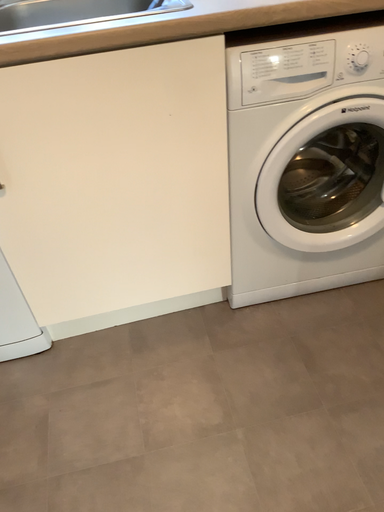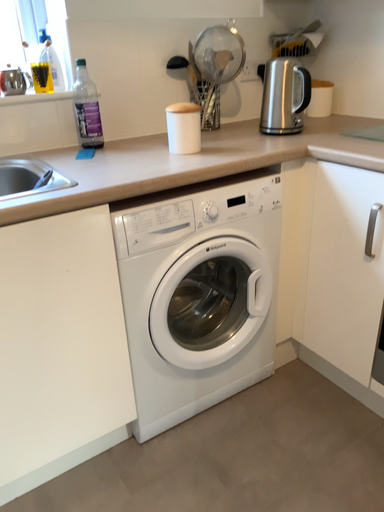
Question: Which way did the camera rotate in the video?

Choices:
 (A) rotated right
 (B) rotated left

Answer: (A)